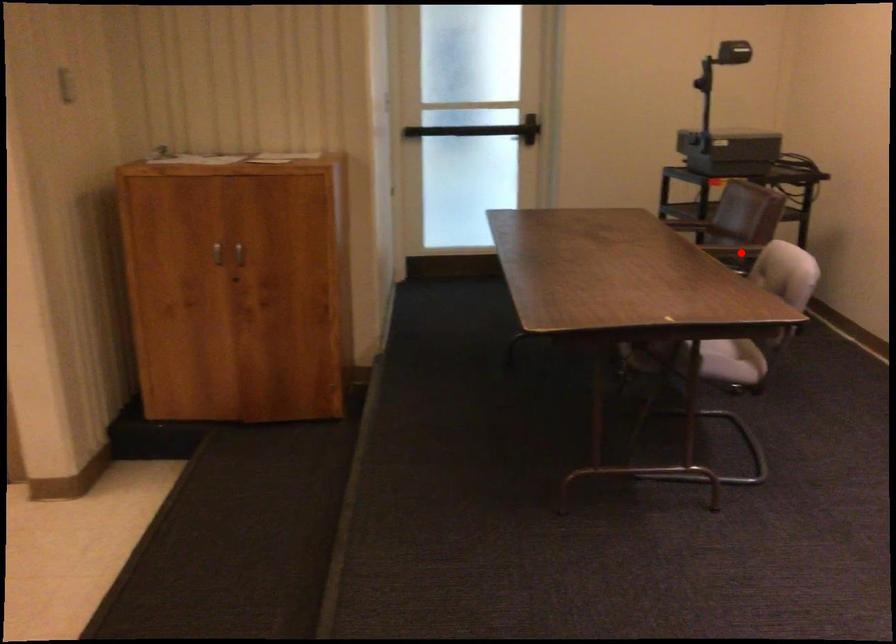
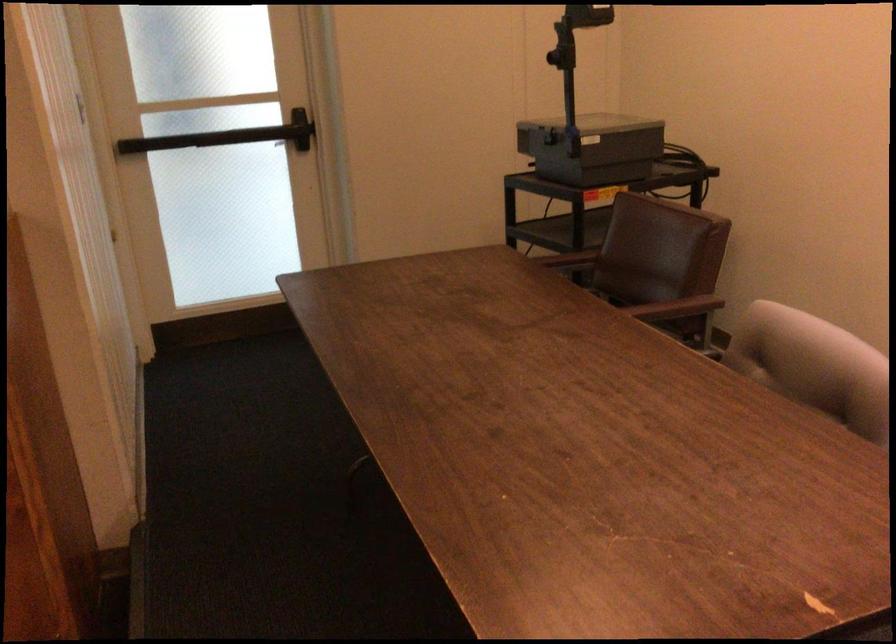
Question: I am providing you with two images of the same scene from different viewpoints. Given a red point in image1, look at the same physical point in image2. Is it:

Choices:
 (A) Closer to the viewpoint
 (B) Farther from the viewpoint

Answer: (A)